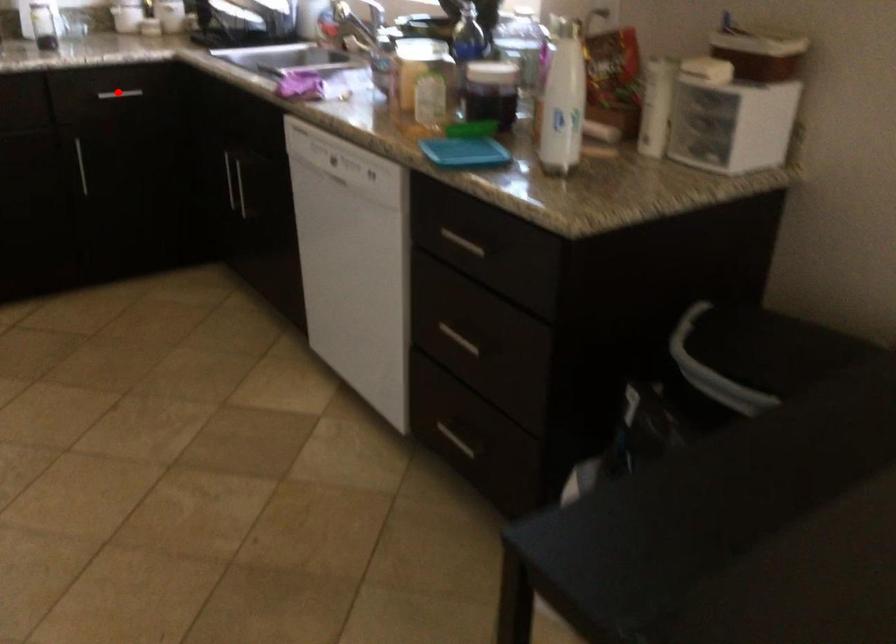
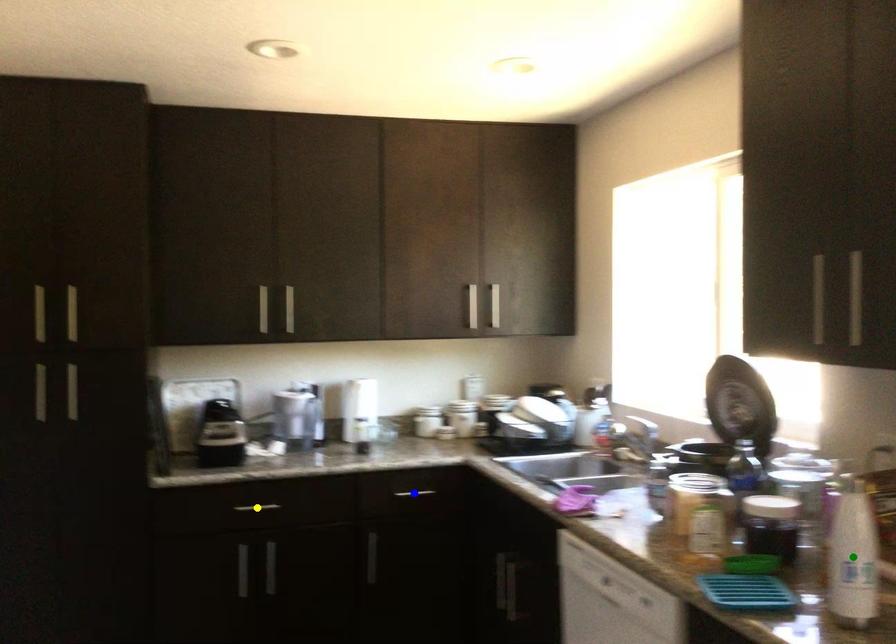
Question: I am providing you with two images of the same scene from different viewpoints. A red point is marked on the first image. You are given multiple points on the second image. In image 2, which mark is for the same physical point as the one in image 1?

Choices:
 (A) blue point
 (B) yellow point
 (C) green point

Answer: (A)